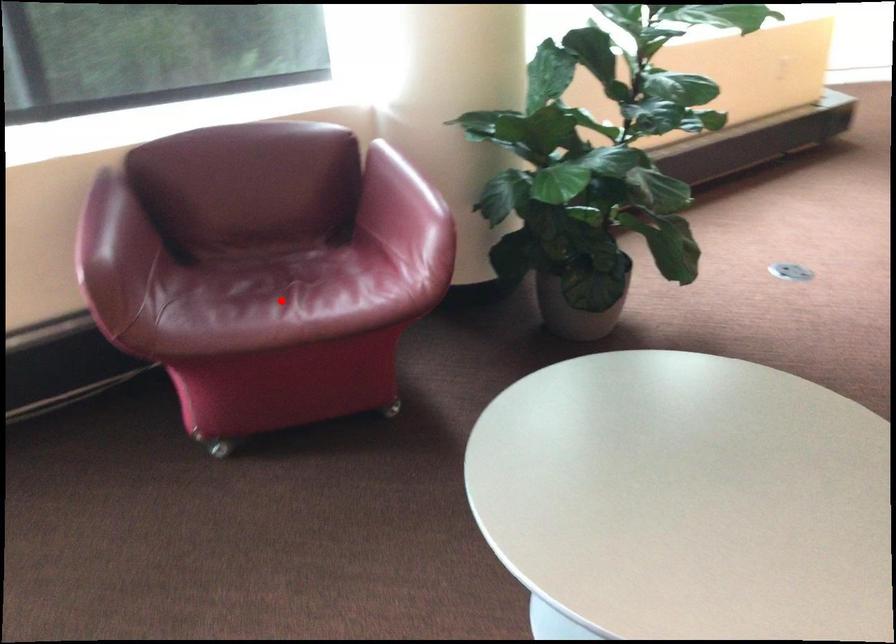
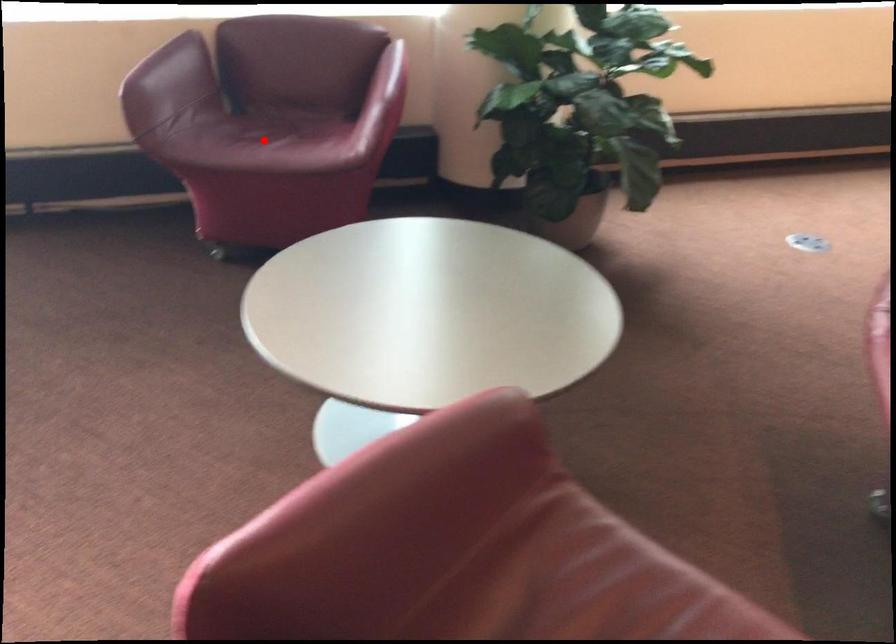
I am providing you with two images of the same scene from different viewpoints. A red point is marked on the first image and another point is marked on the second image. Are the points marked in image1 and image2 representing the same 3D position?

Yes